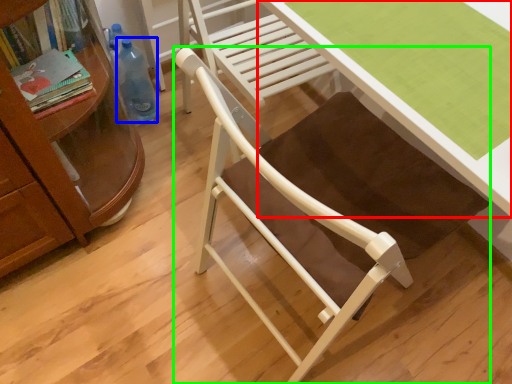
Question: Based on their relative distances, which object is nearer to desk (highlighted by a red box)? Choose from bottle (highlighted by a blue box) and chair (highlighted by a green box).

Choices:
 (A) bottle
 (B) chair

Answer: (B)